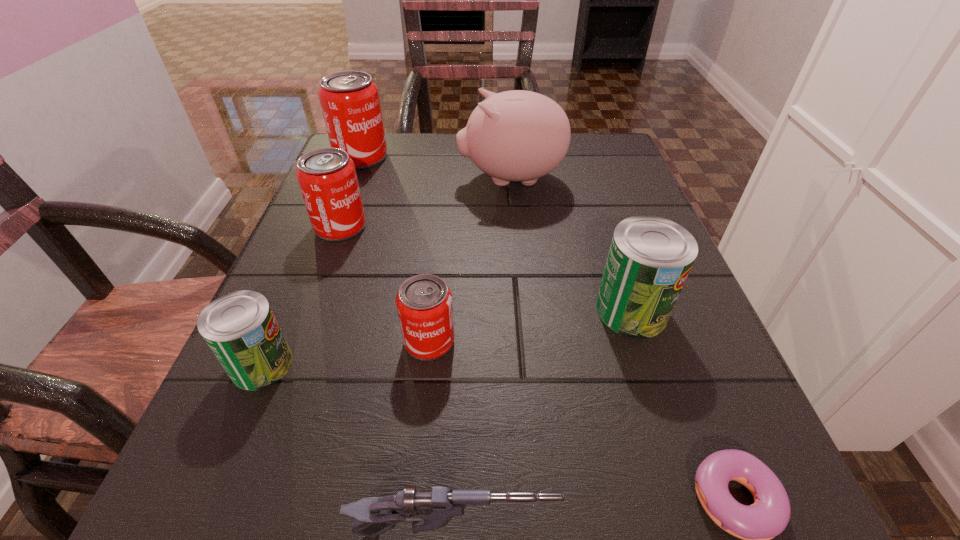
The height and width of the screenshot is (540, 960). What are the coordinates of `can that is positioned at the far edge` in the screenshot? It's located at (349, 100).

You are a GUI agent. You are given a task and a screenshot of the screen. Output one action in this format:
    pyautogui.click(x=<x>, y=<y>)
    Task: Click on the piggy bank that is at the right edge
    
    Given the screenshot: What is the action you would take?
    pyautogui.click(x=517, y=135)

At what (x,y) coordinates should I click in order to perform the action: click on can that is at the right edge. Please return your answer as a coordinate pair (x, y). Looking at the image, I should click on (650, 257).

Locate an element on the screen. This screenshot has height=540, width=960. object at the far left corner is located at coordinates (349, 100).

This screenshot has height=540, width=960. I want to click on object that is at the far right corner, so click(x=517, y=135).

The width and height of the screenshot is (960, 540). In the image, there is a desktop. In order to click on free space at the far edge in this screenshot , I will do `click(411, 133)`.

The height and width of the screenshot is (540, 960). I want to click on vacant space at the near edge of the desktop, so click(x=594, y=494).

Locate an element on the screen. This screenshot has height=540, width=960. vacant point at the left edge is located at coordinates (292, 242).

You are a GUI agent. You are given a task and a screenshot of the screen. Output one action in this format:
    pyautogui.click(x=<x>, y=<y>)
    Task: Click on the blank space at the right edge of the desktop
    The image size is (960, 540).
    Given the screenshot: What is the action you would take?
    click(x=671, y=357)

Locate an element on the screen. The width and height of the screenshot is (960, 540). vacant space at the far left corner of the desktop is located at coordinates (403, 144).